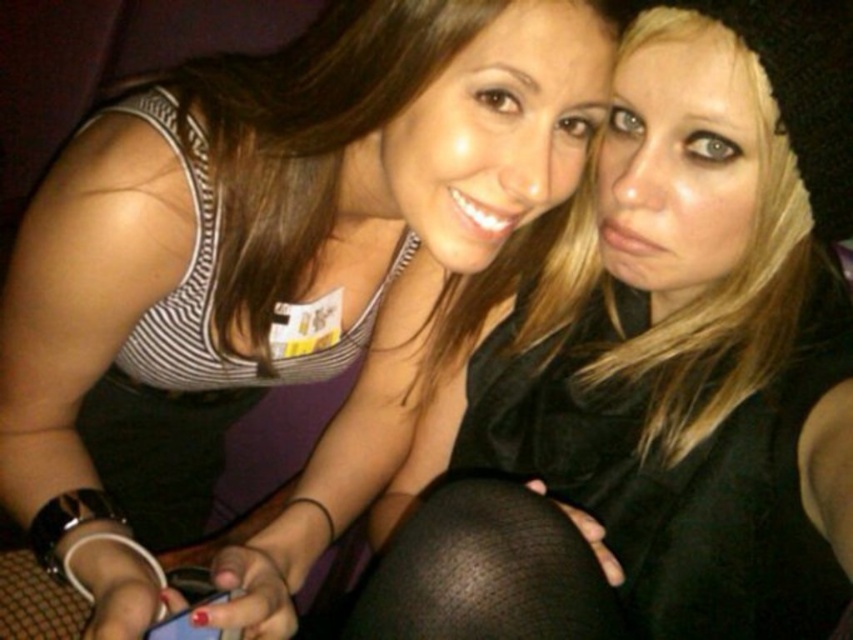
Question: In this image, where is matte black tank top at upper left located relative to black mesh tights at lower center?

Choices:
 (A) left
 (B) right

Answer: (B)

Question: Is black mesh tights at lower center positioned before matte blue phone at lower center?

Choices:
 (A) no
 (B) yes

Answer: (B)

Question: Which point is farther to the camera?

Choices:
 (A) tap(573, 621)
 (B) tap(722, 10)

Answer: (A)

Question: Which of these objects is positioned closest to the black mesh tights at lower center?

Choices:
 (A) matte blue phone at lower center
 (B) matte black leggings at lower right

Answer: (A)

Question: Is matte black tank top at upper left above matte blue phone at lower center?

Choices:
 (A) no
 (B) yes

Answer: (B)

Question: Which object is the closest to the matte black leggings at lower right?

Choices:
 (A) matte black tank top at upper left
 (B) matte blue phone at lower center
 (C) black mesh tights at lower center

Answer: (A)